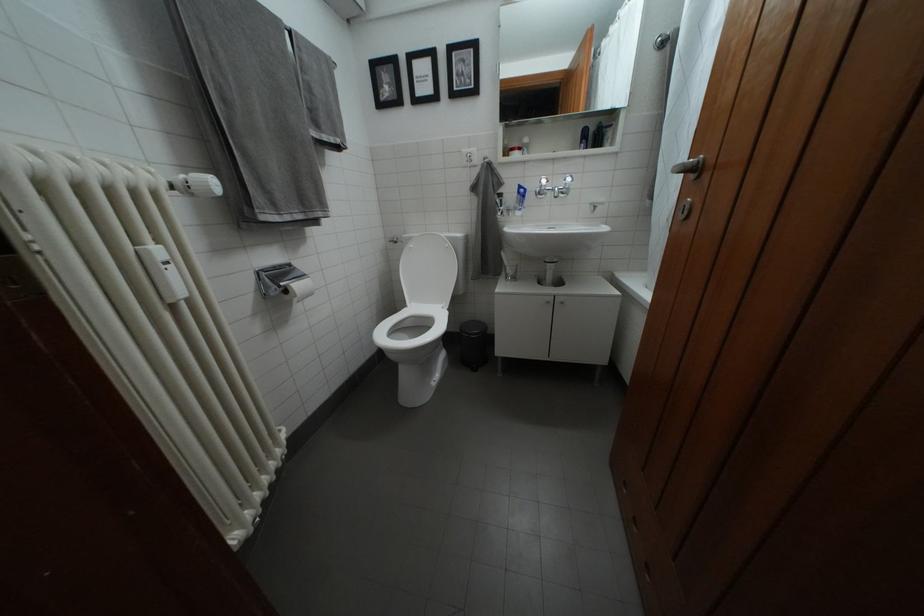
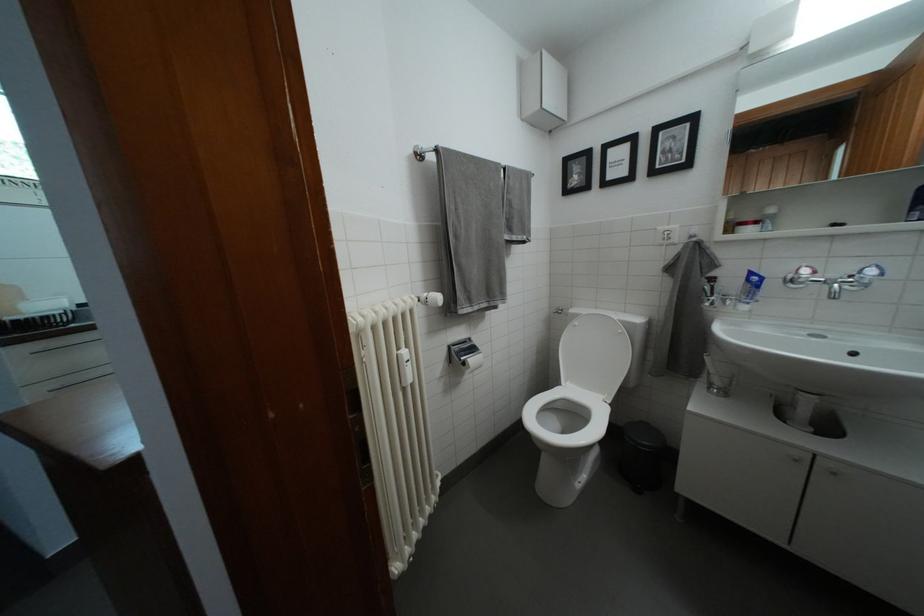
In the second image, find the point that corresponds to pixel 546 196 in the first image.

(799, 282)